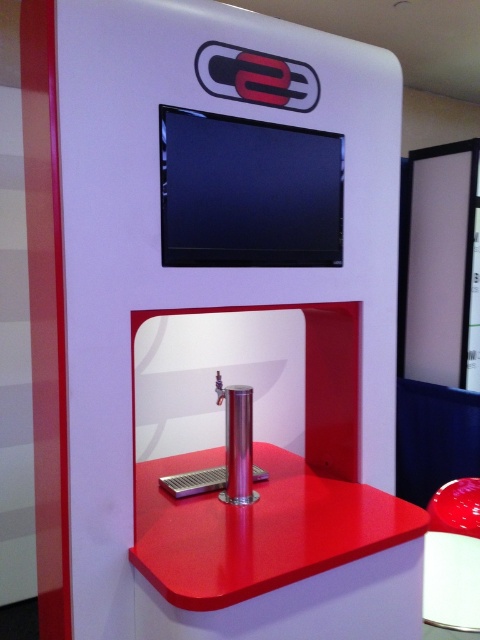
You are a person with a 50 cm wide box that you need to place between the shiny red table at center and the glossy plastic stool at lower right. Based on the scene description, will the box fit in the space between them?

The distance between the shiny red table at center and the glossy plastic stool at lower right is 49.47 centimeters. Since the box is 50 cm wide, it will not fit in the space between them as the available space is slightly narrower than the box.

You are a person with a beverage container that needs to be filled. You see a shiny red table at center and a glossy plastic stool at lower right. Which object should you approach first to fill your container?

You should approach the shiny red table at center first because it is closer to you than the glossy plastic stool at lower right.

You are standing in front of the device and notice two points marked on it. The first point is at coordinates point [407,541] and the second point is at point [443,564]. Which point is closer to you?

Point [407,541] is closer to the viewer than point [443,564].